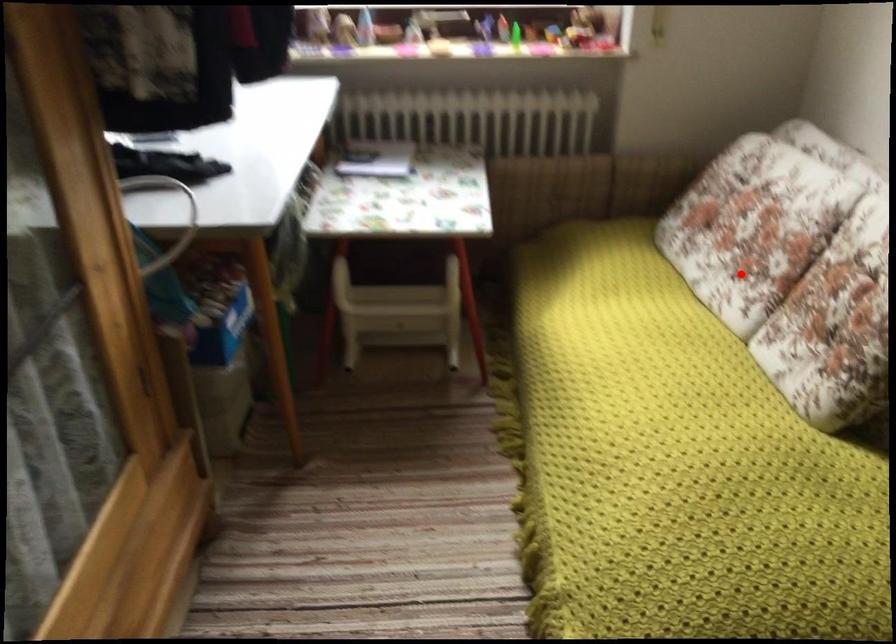
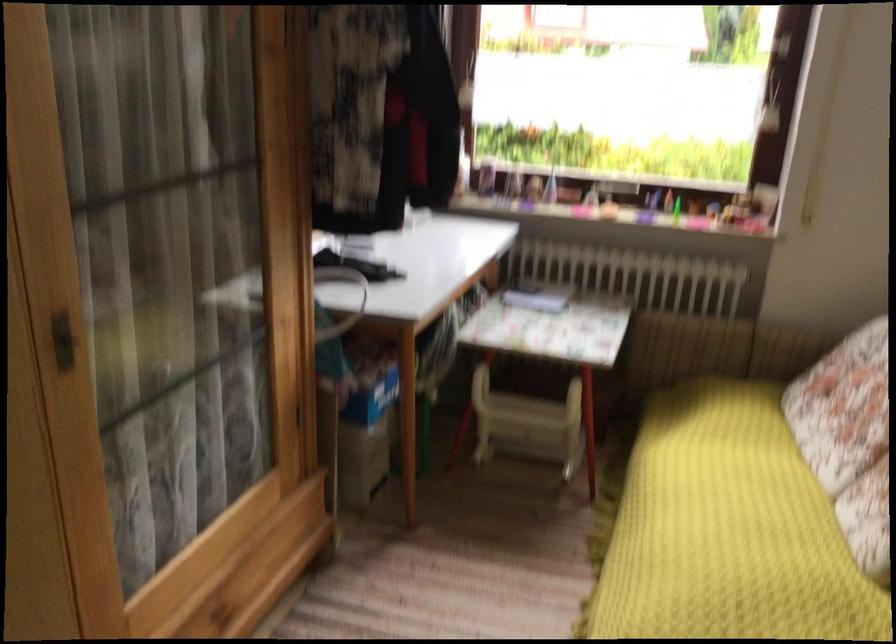
Find the pixel in the second image that matches the highlighted location in the first image.

(849, 439)